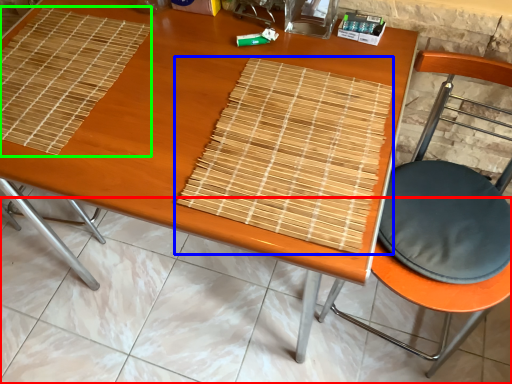
Question: Considering the real-world distances, which object is closest to tile (highlighted by a red box)? mat (highlighted by a blue box) or mat (highlighted by a green box).

Choices:
 (A) mat
 (B) mat

Answer: (B)